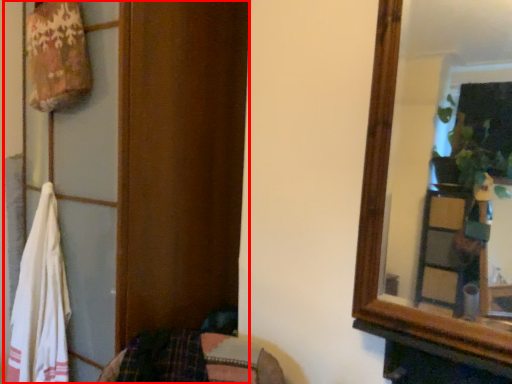
Question: From the image's perspective, what is the correct spatial positioning of dresser (annotated by the red box) in reference to beach towel?

Choices:
 (A) above
 (B) below

Answer: (A)